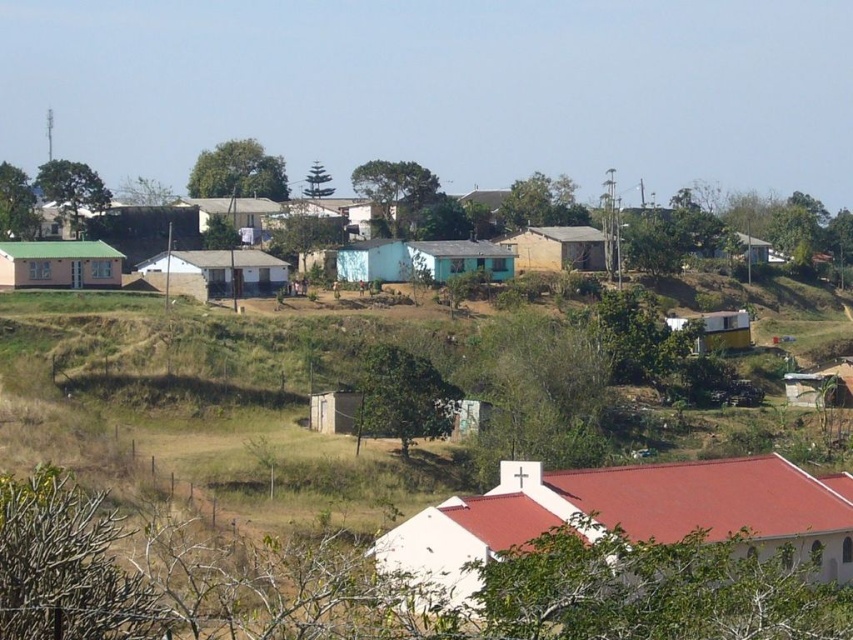
You are a photographer planning to capture the church and the hut in a single frame. Given that the white matte church at lower center is taller than the white plastic hut at right, which structure should you position closer to the camera to ensure both are fully visible in the photo?

To ensure both the white matte church at lower center and the white plastic hut at right are fully visible in the photo, you should position the white plastic hut at right closer to the camera since it is shorter than the church.

You are standing at the entrance of the settlement and want to visit both the white matte house at center and the matte green house at left. Which house will you see first as you walk towards the center of the settlement?

The white matte house at center will be seen first because the matte green house at left is positioned behind it.

You are planning to host a small gathering and need to choose between the white matte house at center and the light brown wooden hut at upper right. Which location has more space to accommodate more guests?

The white matte house at center has a larger width than the light brown wooden hut at upper right, so it can accommodate more guests.